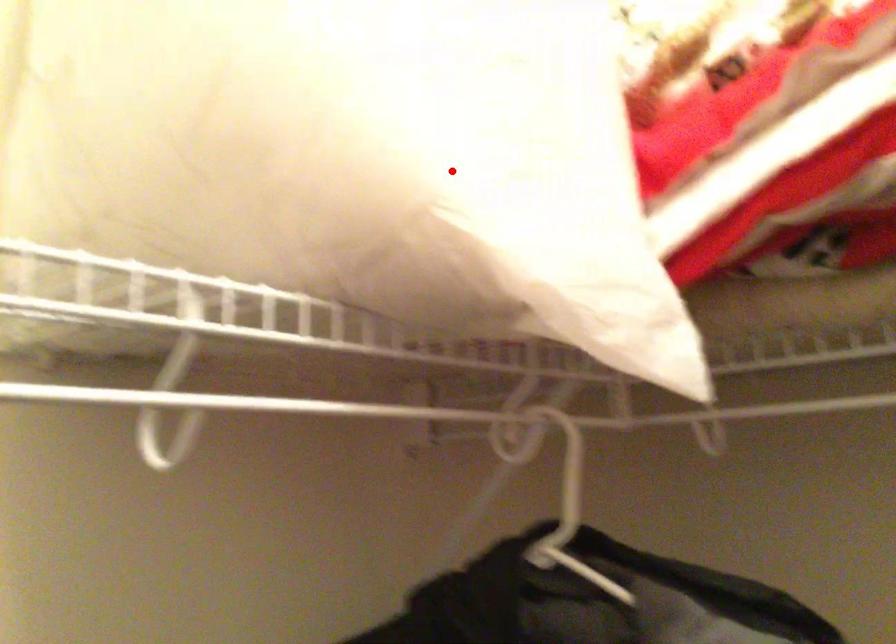
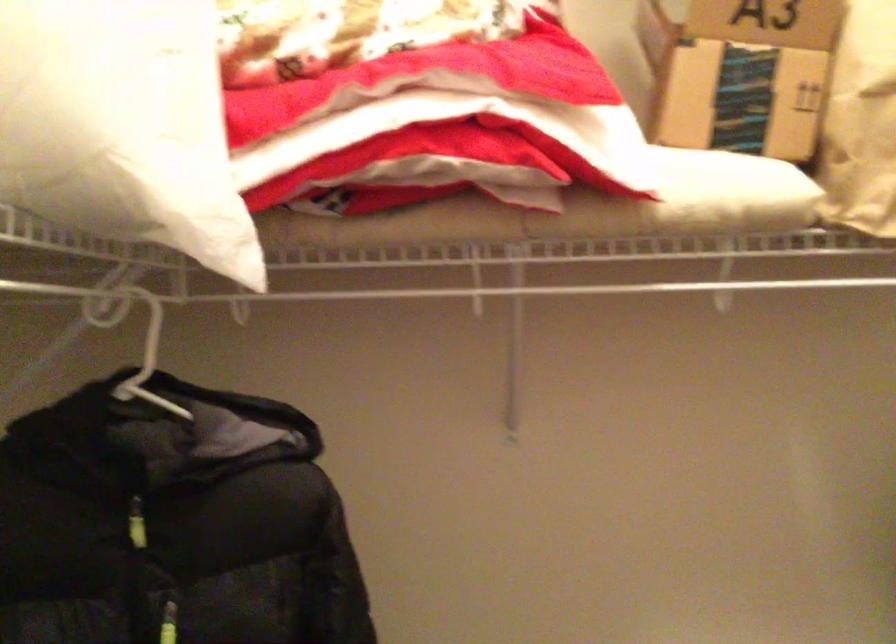
Locate, in the second image, the point that corresponds to the highlighted location in the first image.

(123, 126)